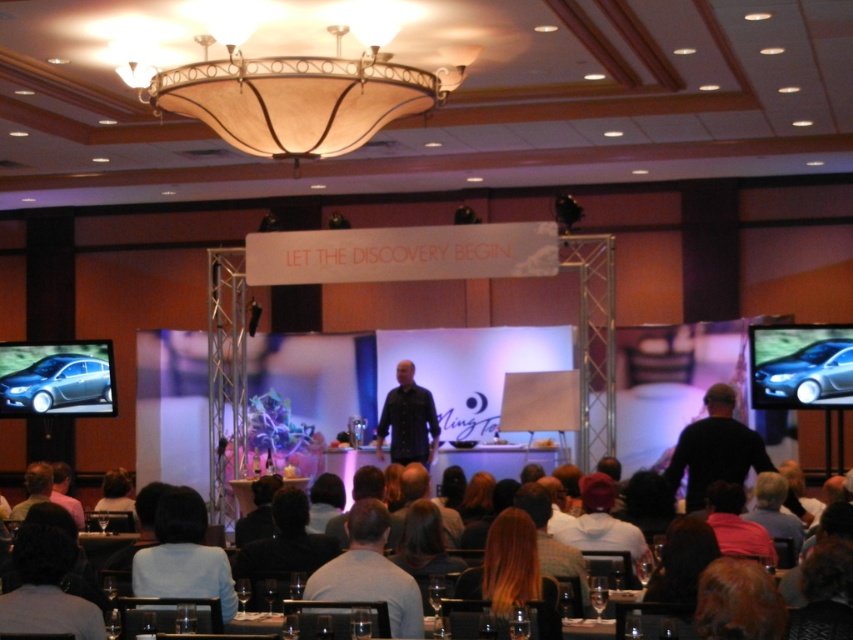
You are an event planner checking the stage setup. You need to ensure that the metallic car at left and the gray fabric shirt at center are visible to the audience. Which object might block the view of the other if placed closer to the front of the stage?

The metallic car at left is bigger than the gray fabric shirt at center, so if placed closer to the front, it might block the view of the gray fabric shirt at center.

You are an event planner standing at the back of the room. You notice the translucent glass chandelier at upper center and the blonde hair at lower right. Which object is positioned higher in the scene?

The translucent glass chandelier at upper center is positioned higher in the scene than the blonde hair at lower right.

You are organizing a photo shoot and need to place a camera on a tripod between the metallic car at left and the gray fabric shirt at center. The camera requires a minimum of 1 meter of space between the two objects to avoid obstruction. Based on the scene description, can you confirm if there is enough space?

The metallic car at left is wider than the gray fabric shirt at center. However, the exact distance between them isn